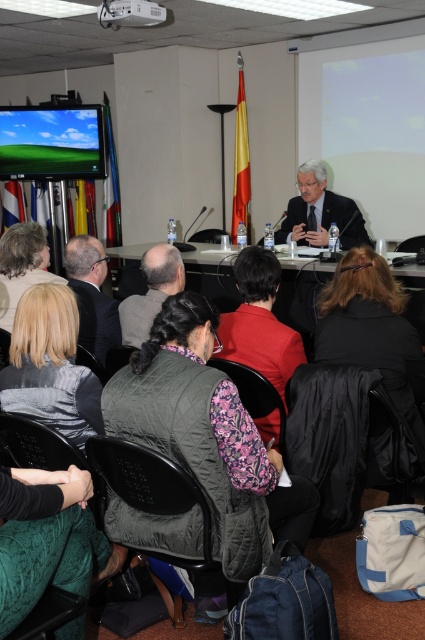
You are an attendee at the conference and want to approach the speaker. Which object, the matte black suit at center or the dark gray vest at center, should you walk towards first?

You should walk towards the matte black suit at center first because it is closer to you than the dark gray vest at center.